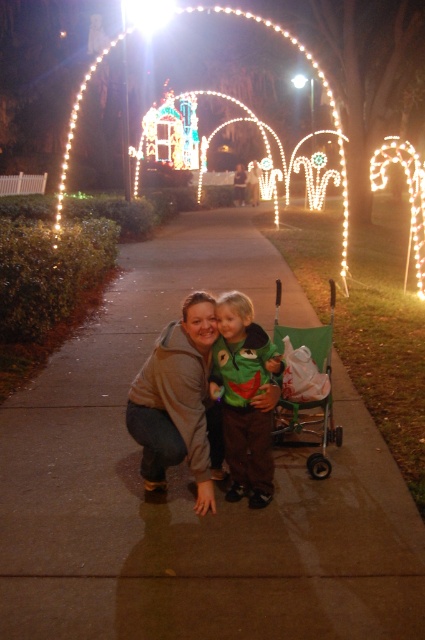
Based on the photo, does green plastic baby carriage at lower right lie in front of illuminated wireframe arch at center?

Yes, it is in front of illuminated wireframe arch at center.

Who is shorter, green plastic baby carriage at lower right or illuminated wireframe arch at center?

green plastic baby carriage at lower right

The height and width of the screenshot is (640, 425). I want to click on green plastic baby carriage at lower right, so click(x=308, y=429).

Who is positioned more to the right, brown soft jacket at center or illuminated wireframe arch at center?

illuminated wireframe arch at center

Is point (130, 432) in front of point (343, 170)?

Yes, point (130, 432) is closer to viewer.

Who is more forward, (186, 442) or (209, 92)?

Point (186, 442)

You are a GUI agent. You are given a task and a screenshot of the screen. Output one action in this format:
    pyautogui.click(x=<x>, y=<y>)
    Task: Click on the brown soft jacket at center
    
    Given the screenshot: What is the action you would take?
    pyautogui.click(x=180, y=403)

Between brown soft jacket at center and green fuzzy sweater at center, which one appears on the right side from the viewer's perspective?

green fuzzy sweater at center

Is brown soft jacket at center further to camera compared to green fuzzy sweater at center?

A: No, brown soft jacket at center is closer to the viewer.

Where is `brown soft jacket at center`? This screenshot has width=425, height=640. brown soft jacket at center is located at coordinates (180, 403).

The height and width of the screenshot is (640, 425). Identify the location of brown soft jacket at center. (180, 403).